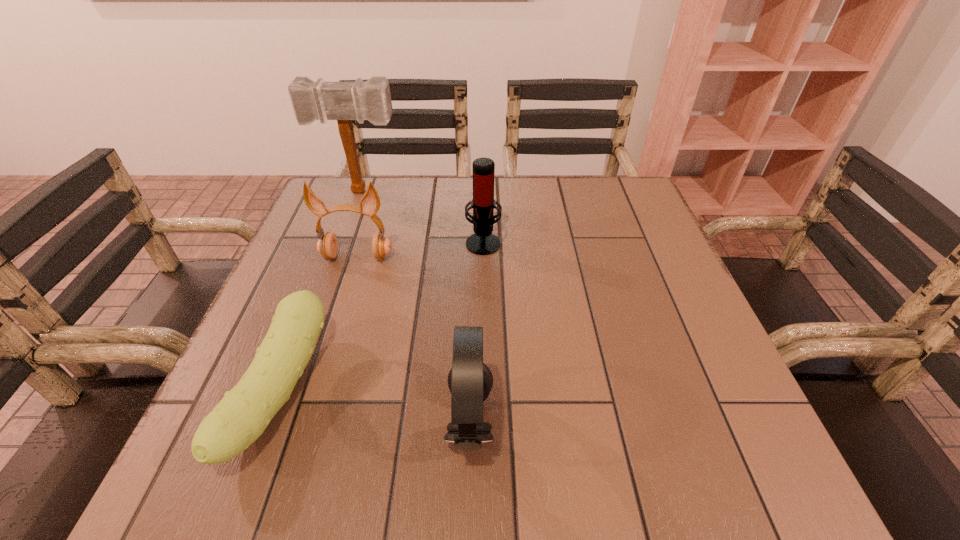
At what (x,y) coordinates should I click in order to perform the action: click on vacant space that is in between the tallest object and the microphone. Please return your answer as a coordinate pair (x, y). The width and height of the screenshot is (960, 540). Looking at the image, I should click on (422, 217).

Locate an element on the screen. object that is the fourth closest to the microphone is located at coordinates (470, 381).

Identify which object is the fourth closest to the right earphone. Please provide its 2D coordinates. Your answer should be formatted as a tuple, i.e. [(x, y)], where the tuple contains the x and y coordinates of a point satisfying the conditions above.

[(343, 101)]